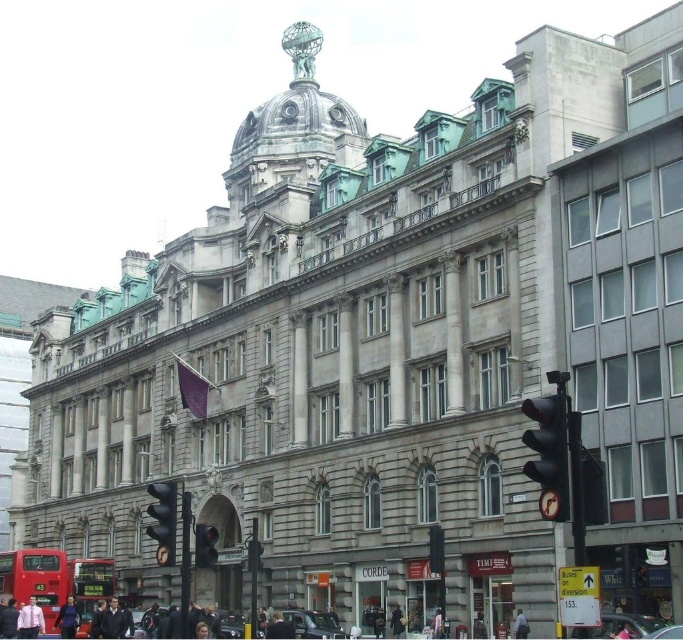
Question: Among these points, which one is nearest to the camera?

Choices:
 (A) (100, 611)
 (B) (12, 602)

Answer: (A)

Question: Which of these objects is positioned farthest from the dark brown leather coat at center?

Choices:
 (A) black fabric jacket at lower left
 (B) dark gray jacket at center
 (C) light pink fabric at lower center

Answer: (A)

Question: Is the position of dark suit at lower center more distant than that of black matte traffic light at center?

Choices:
 (A) no
 (B) yes

Answer: (B)

Question: Does black matte traffic light at center have a larger size compared to light pink shirt at lower left?

Choices:
 (A) no
 (B) yes

Answer: (B)

Question: Is dark brown leather coat at center smaller than dark gray suit at center?

Choices:
 (A) yes
 (B) no

Answer: (A)

Question: Estimate the real-world distances between objects in this image. Which object is closer to the black matte traffic light at center?

Choices:
 (A) shiny black car at center
 (B) black glass traffic light at lower left
 (C) red metallic bus at lower left

Answer: (B)